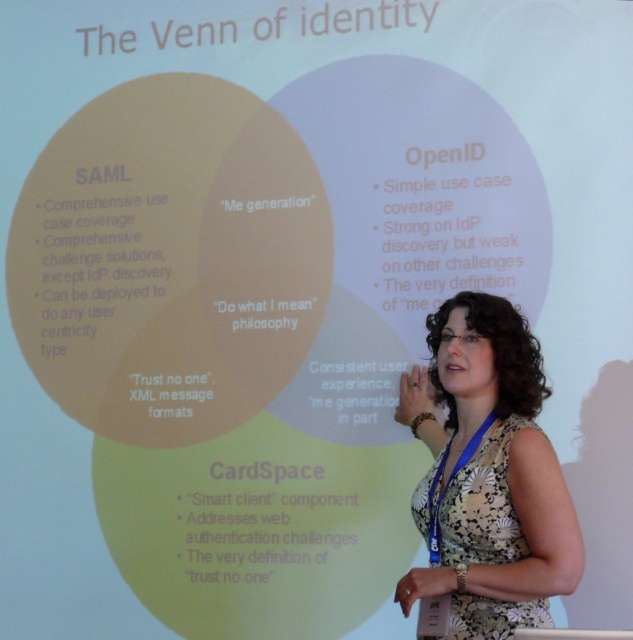
Question: Which point is closer to the camera?

Choices:
 (A) [422, 483]
 (B) [458, 467]

Answer: (B)

Question: Is floral dress at center in front of floral print fabric dress at lower right?

Choices:
 (A) yes
 (B) no

Answer: (A)

Question: Can you confirm if floral dress at center is smaller than floral print fabric dress at lower right?

Choices:
 (A) yes
 (B) no

Answer: (B)

Question: Does floral dress at center come in front of floral print fabric dress at lower right?

Choices:
 (A) no
 (B) yes

Answer: (B)